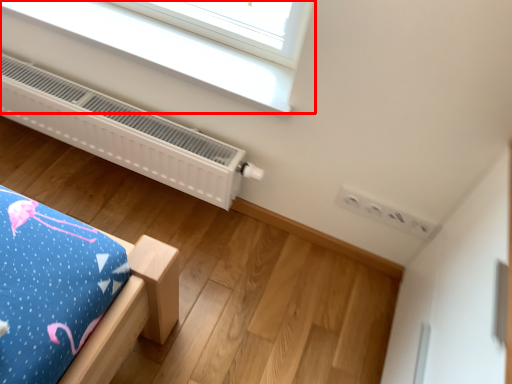
Question: In this image, where is window (annotated by the red box) located relative to heater?

Choices:
 (A) left
 (B) right

Answer: (B)